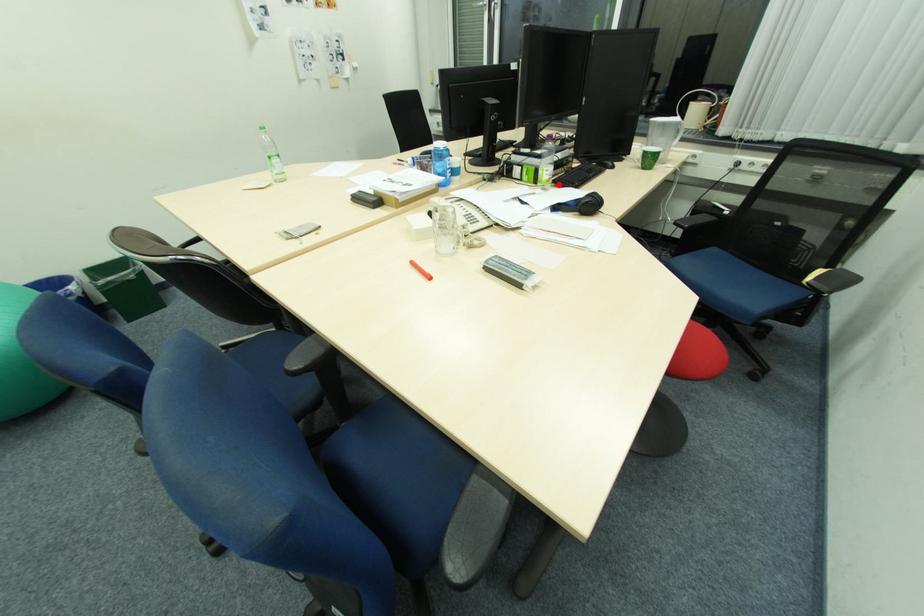
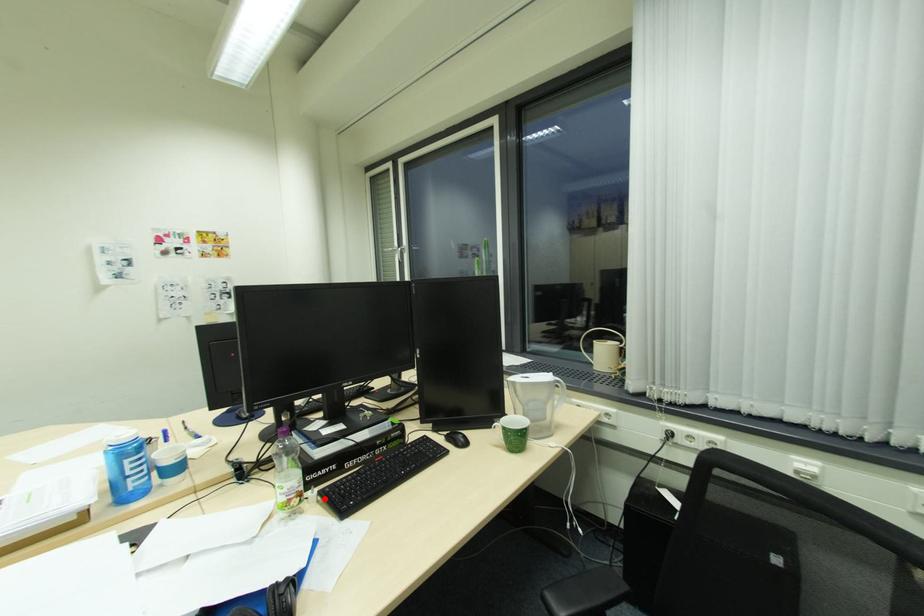
I am providing you with two images of the same scene from different viewpoints. A red point is marked on the first image and another point is marked on the second image. Is the red point in image1 aligned with the point shown in image2?

Yes